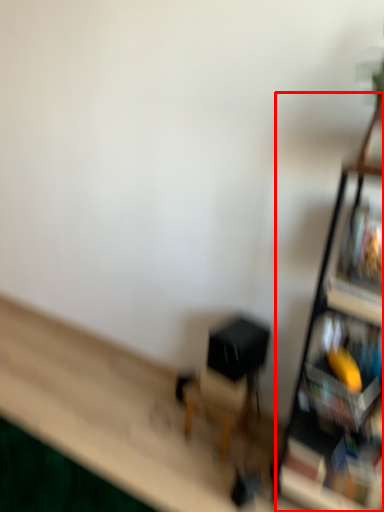
Question: From the image's perspective, what is the correct spatial relationship of shelf (annotated by the red box) in relation to swivel chair?

Choices:
 (A) below
 (B) above

Answer: (B)